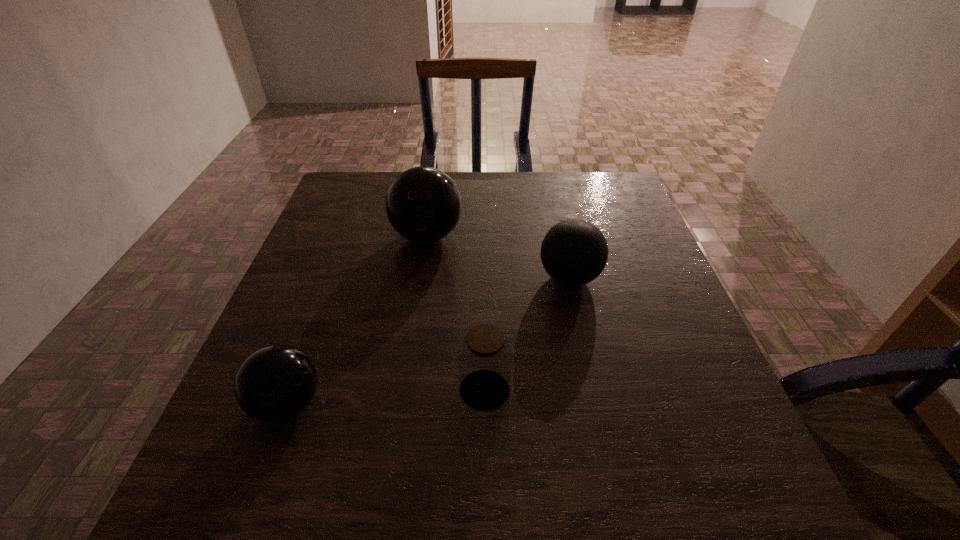
I want to click on free space at the near right corner of the desktop, so click(765, 511).

You are a GUI agent. You are given a task and a screenshot of the screen. Output one action in this format:
    pyautogui.click(x=<x>, y=<y>)
    Task: Click on the free area in between the rightmost bowling ball and the tallest object
    
    Given the screenshot: What is the action you would take?
    [x=498, y=256]

Identify the location of vacant space in between the third object from right to left and the rightmost object. This screenshot has height=540, width=960. (498, 256).

Where is `free space between the third object from left to right and the rightmost bowling ball`? The width and height of the screenshot is (960, 540). free space between the third object from left to right and the rightmost bowling ball is located at coordinates (527, 334).

Locate an element on the screen. The height and width of the screenshot is (540, 960). free space between the second bowling ball from right to left and the rightmost object is located at coordinates (498, 256).

I want to click on vacant region between the shortest bowling ball and the rightmost bowling ball, so click(x=428, y=341).

Identify the location of vacant region between the third object from left to right and the nearest bowling ball. (386, 397).

Locate an element on the screen. Image resolution: width=960 pixels, height=540 pixels. free space between the rightmost bowling ball and the second object from right to left is located at coordinates (527, 334).

Locate an element on the screen. The height and width of the screenshot is (540, 960). vacant point located between the jar and the shortest bowling ball is located at coordinates (386, 397).

What are the coordinates of `free space between the rightmost object and the leftmost object` in the screenshot? It's located at (428, 341).